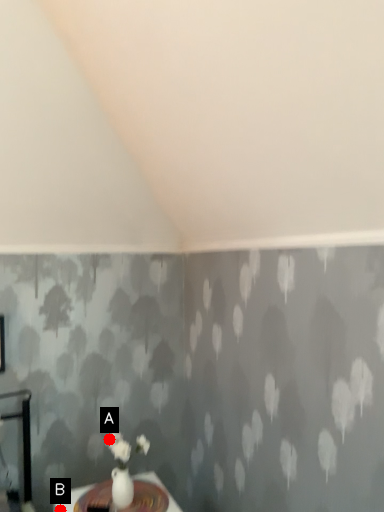
Question: Two points are circled on the image, labeled by A and B beside each circle. Which point is farther from the camera taking this photo?

Choices:
 (A) A is further
 (B) B is further

Answer: (A)